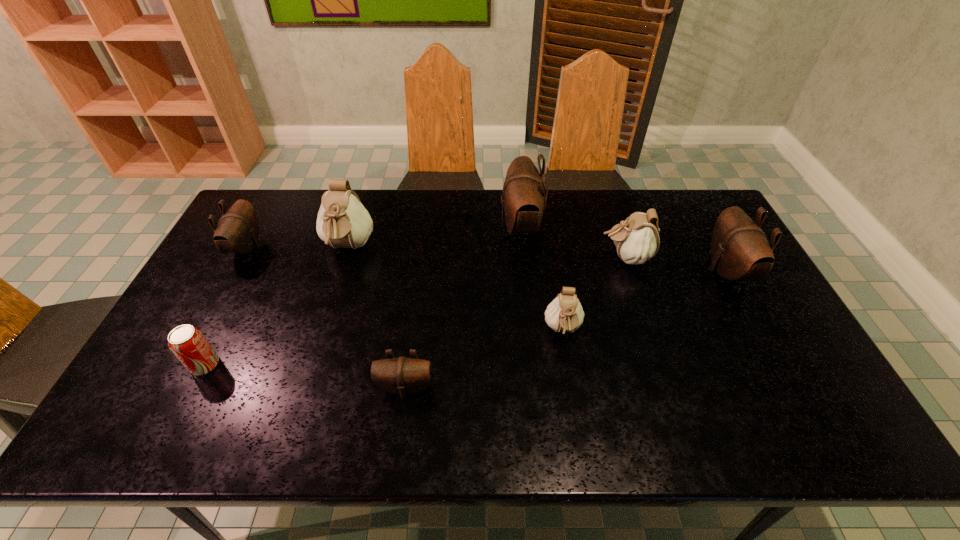
Locate an element on the screen. The width and height of the screenshot is (960, 540). free space between the soda can and the rightmost pouch is located at coordinates (466, 318).

Identify the location of blank region between the rightmost white pouch and the second white pouch from right to left. (594, 294).

The width and height of the screenshot is (960, 540). Identify the location of free space between the smallest brown pouch and the third brown pouch from left to right. click(x=463, y=307).

This screenshot has width=960, height=540. Find the location of `free spot between the leftmost pouch and the sixth pouch from left to right`. free spot between the leftmost pouch and the sixth pouch from left to right is located at coordinates (436, 253).

Where is `vacant area that lies between the second biggest white pouch and the soda can`? The image size is (960, 540). vacant area that lies between the second biggest white pouch and the soda can is located at coordinates (415, 311).

Identify which object is the closest to the second white pouch from right to left. Please provide its 2D coordinates. Your answer should be formatted as a tuple, i.e. [(x, y)], where the tuple contains the x and y coordinates of a point satisfying the conditions above.

[(636, 239)]

Select which object is the closest to the biggest brown pouch. Please provide its 2D coordinates. Your answer should be formatted as a tuple, i.e. [(x, y)], where the tuple contains the x and y coordinates of a point satisfying the conditions above.

[(636, 239)]

Locate which pouch is the sixth closest to the biggest brown pouch. Please provide its 2D coordinates. Your answer should be formatted as a tuple, i.e. [(x, y)], where the tuple contains the x and y coordinates of a point satisfying the conditions above.

[(237, 232)]

Select which pouch is the fourth closest to the third nearest object. Please provide its 2D coordinates. Your answer should be formatted as a tuple, i.e. [(x, y)], where the tuple contains the x and y coordinates of a point satisfying the conditions above.

[(739, 248)]

Locate an element on the screen. This screenshot has width=960, height=540. the fourth closest brown pouch to the third object from left to right is located at coordinates (739, 248).